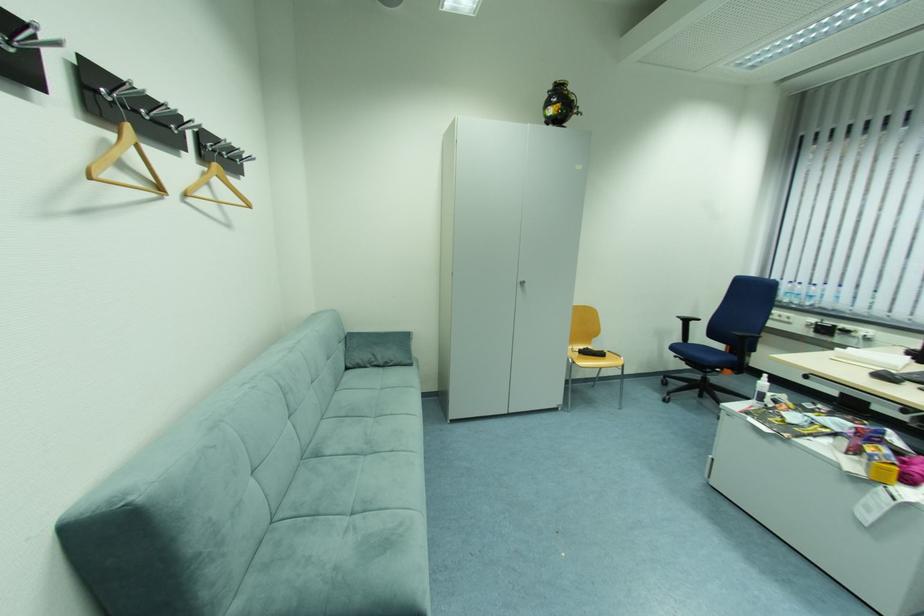
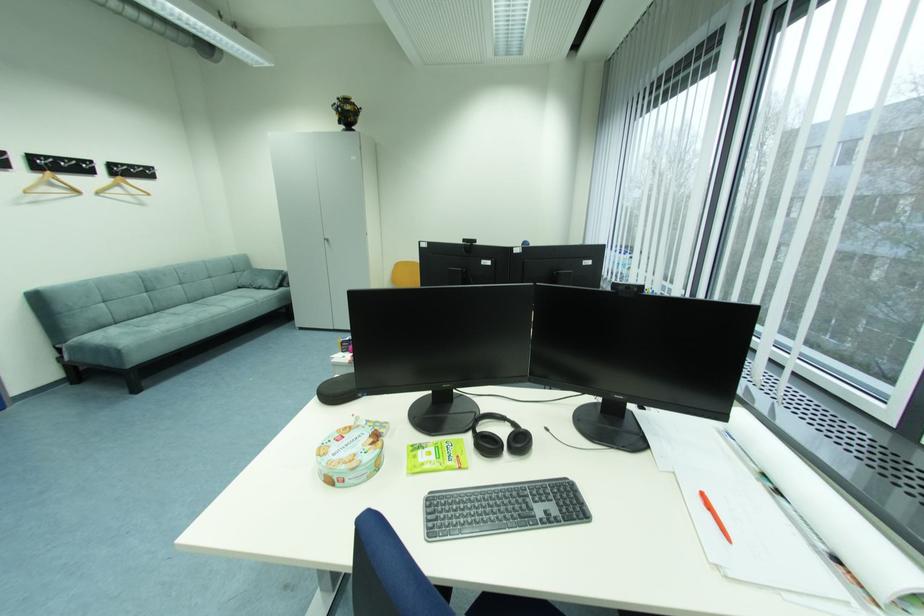
The point at (558, 87) is marked in the first image. Where is the corresponding point in the second image?

(344, 103)